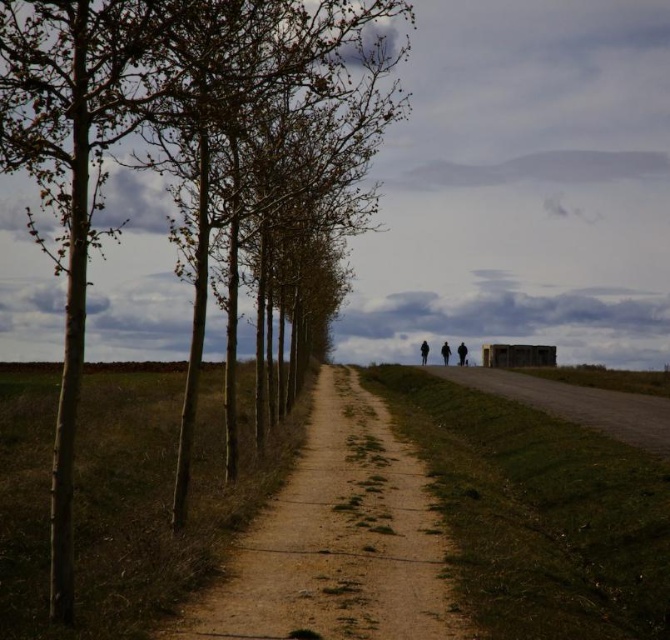
Who is positioned more to the left, smooth bark trees at left or dark textured coat at center?

smooth bark trees at left

Can you confirm if smooth bark trees at left is bigger than dark textured coat at center?

Indeed, smooth bark trees at left has a larger size compared to dark textured coat at center.

Who is more forward, (x=226, y=204) or (x=423, y=358)?

Positioned in front is point (x=226, y=204).

Locate an element on the screen. smooth bark trees at left is located at coordinates (165, 128).

Between smooth bark trees at left and brown dirt track at center, which one is positioned lower?

brown dirt track at center is below.

Does smooth bark trees at left have a smaller size compared to brown dirt track at center?

Actually, smooth bark trees at left might be larger than brown dirt track at center.

Is point (364, 104) farther from camera compared to point (332, 449)?

Yes, point (364, 104) is farther from viewer.

At what (x,y) coordinates should I click in order to perform the action: click on smooth bark trees at left. Please return your answer as a coordinate pair (x, y). This screenshot has width=670, height=640. Looking at the image, I should click on (165, 128).

Which of these two, brown dirt track at center or dark gray fabric jacket at center-right, stands taller?

With more height is dark gray fabric jacket at center-right.

Does brown dirt track at center appear over dark gray fabric jacket at center-right?

No.

Does point (397, 611) come in front of point (462, 356)?

That is True.

Find the location of a particular element. This screenshot has width=670, height=640. brown dirt track at center is located at coordinates (336, 540).